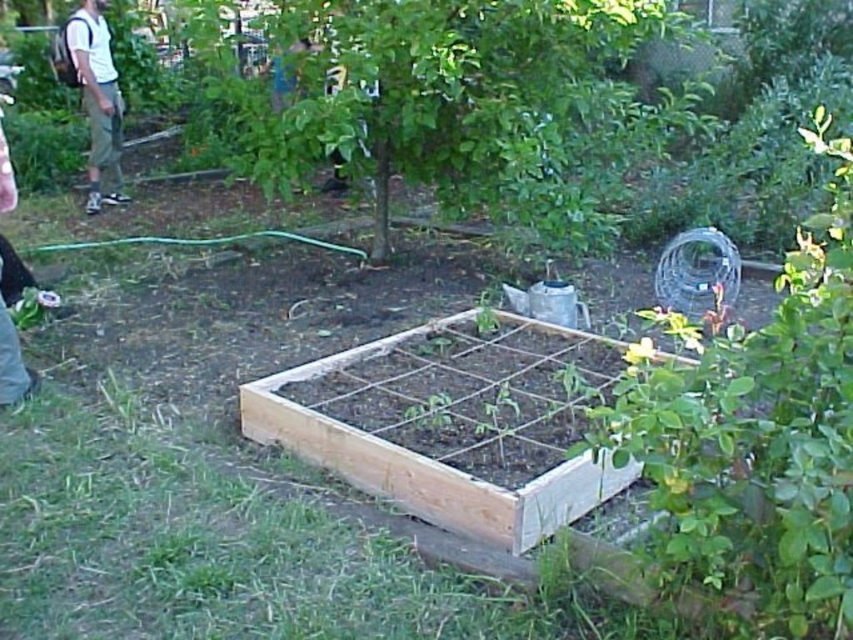
You are standing at the origin point of the garden. You see a point marked at coordinates (450, 104). What object is located at that point?

The point at coordinates (450, 104) corresponds to the green leafy tree at center.

You are standing in the garden and want to reach the point at coordinates point (520, 93). If you can walk 14 feet in a minute, how long will it take you to reach that point?

The distance between you and point (520, 93) is 13.73 feet. Since you can walk 14 feet per minute, it will take approximately 1 minute to reach the point.